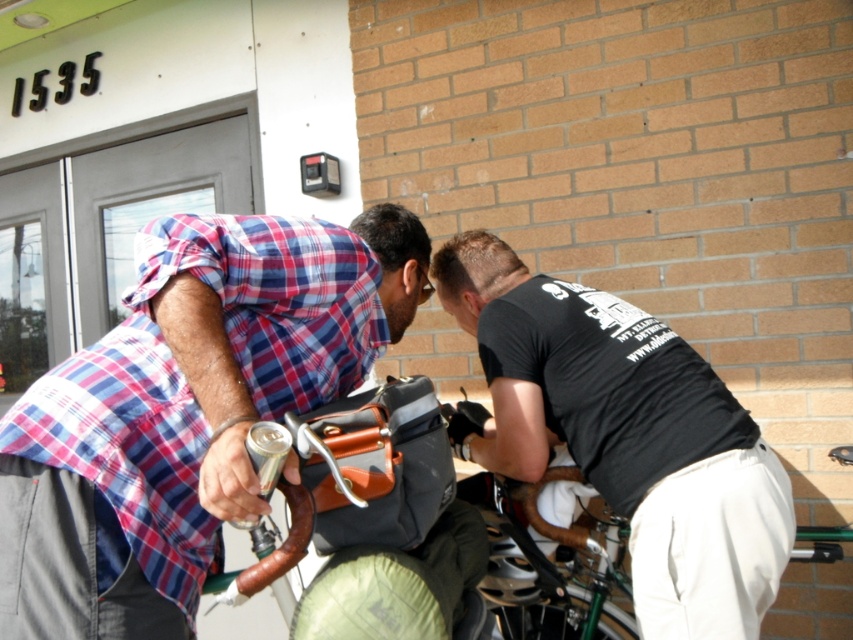
Question: In this image, where is black matte shirt at center located relative to green metallic bicycle at lower center?

Choices:
 (A) left
 (B) right

Answer: (A)

Question: Estimate the real-world distances between objects in this image. Which object is farther from the black matte shirt at center?

Choices:
 (A) plaid shirt at center
 (B) green metallic bicycle at lower center

Answer: (A)

Question: Is the position of plaid shirt at center less distant than that of green metallic bicycle at lower center?

Choices:
 (A) no
 (B) yes

Answer: (B)

Question: Among these points, which one is farthest from the camera?

Choices:
 (A) (492, 260)
 (B) (117, 554)

Answer: (A)

Question: Does black matte shirt at center appear on the left side of green metallic bicycle at lower center?

Choices:
 (A) no
 (B) yes

Answer: (B)

Question: Which object is the closest to the plaid shirt at center?

Choices:
 (A) black matte shirt at center
 (B) green metallic bicycle at lower center

Answer: (A)